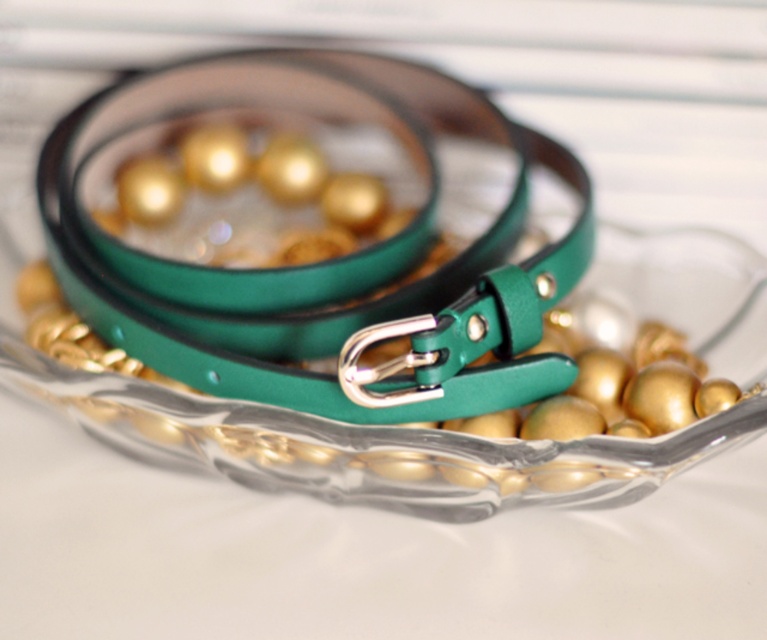
In the scene shown: You are trying to place the green leather belt at center into the transparent glass bowl at center. Based on their sizes, will the belt fit inside the bowl?

The green leather belt at center is larger in size than the transparent glass bowl at center, so it will not fit inside the bowl.

From the picture: You are trying to place a decorative item on the table where the green leather belt at center and transparent glass bowl at center are located. If the table is 10 inches wide, can you fit both items side by side without overlapping?

The green leather belt at center is 3.58 inches away from the transparent glass bowl at center, so yes, they can be placed side by side on a 10 inch wide table since the combined space they occupy plus the 3.58 inches between them would not exceed the table width. However, exact placement depends on their individual sizes which are not provided here.

You are a jeweler who needs to place a new golden necklace into the transparent glass bowl at center. However, you notice the green leather belt at center is currently resting on top of it. Can you directly access the bowl without moving the belt?

The green leather belt at center is located above transparent glass bowl at center, so you cannot directly access the bowl without moving the belt first.